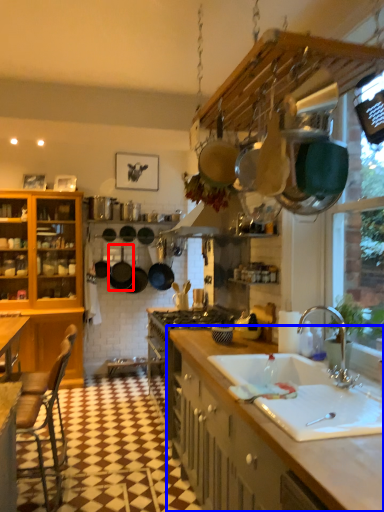
Question: Among these objects, which one is nearest to the camera, frying pan (highlighted by a red box) or countertop (highlighted by a blue box)?

Choices:
 (A) frying pan
 (B) countertop

Answer: (B)